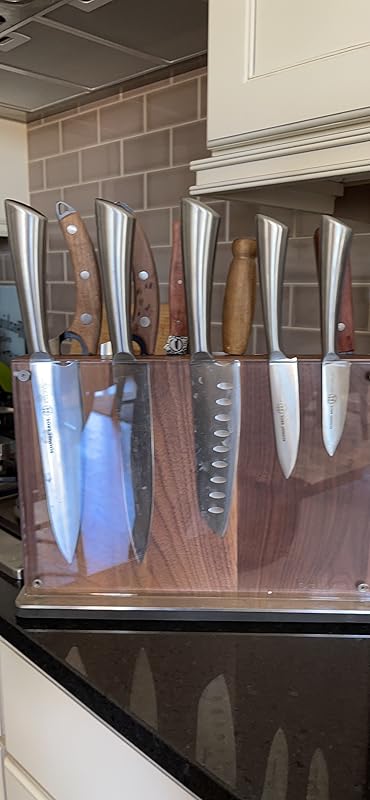
The width and height of the screenshot is (370, 800). Identify the location of black marble surface. (151, 748).